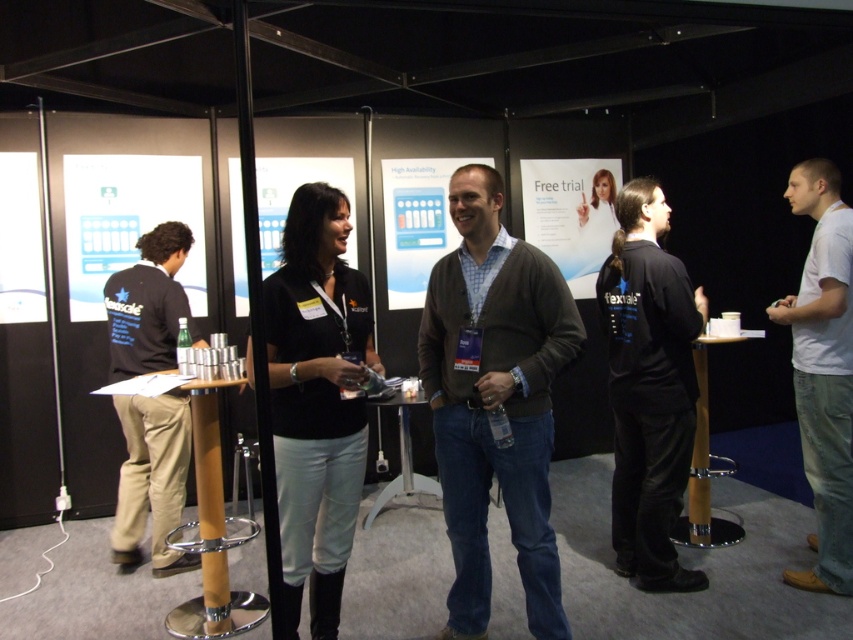
Consider the image. Based on the scene description, can you determine the spatial relationship between the matte brown cardigan at center and the white cotton shirt at right? Specifically, which one is positioned to the left?

The matte brown cardigan at center is positioned to the left of the white cotton shirt at right.

You are standing at point (836, 209) and want to walk to the exit located at point (548, 262). Is the exit in front of you or behind you?

The exit at point (548, 262) is in front of you because it is positioned in front of your current location at point (836, 209).

You are a photographer at the event and want to capture a photo of the white cotton shirt at right and the khaki cotton pants at left. Which object should you focus on first if you want to ensure both are in focus without adjusting the camera settings?

You should focus on the khaki cotton pants at left first because it has a greater width than the white cotton shirt at right, allowing for a deeper depth of field to include both in focus.